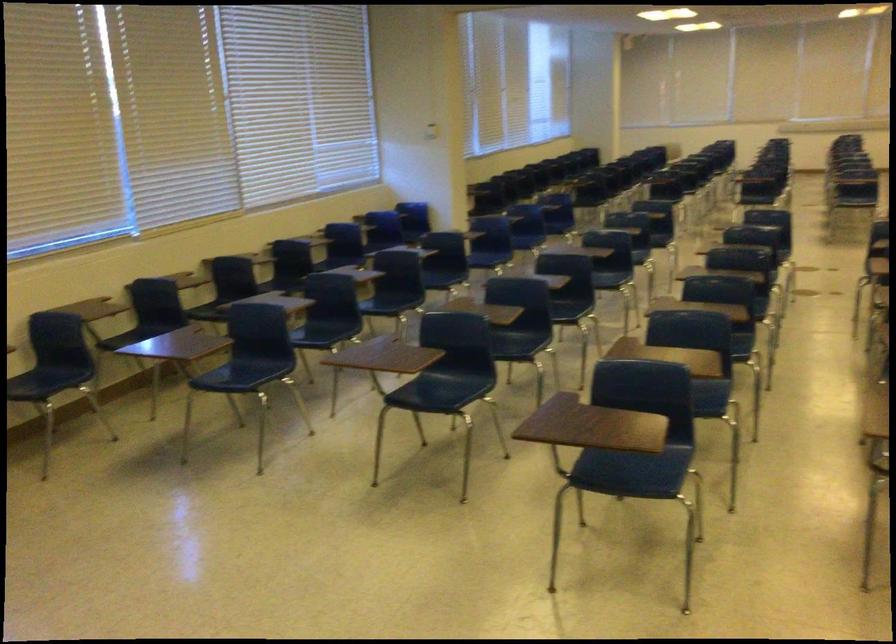
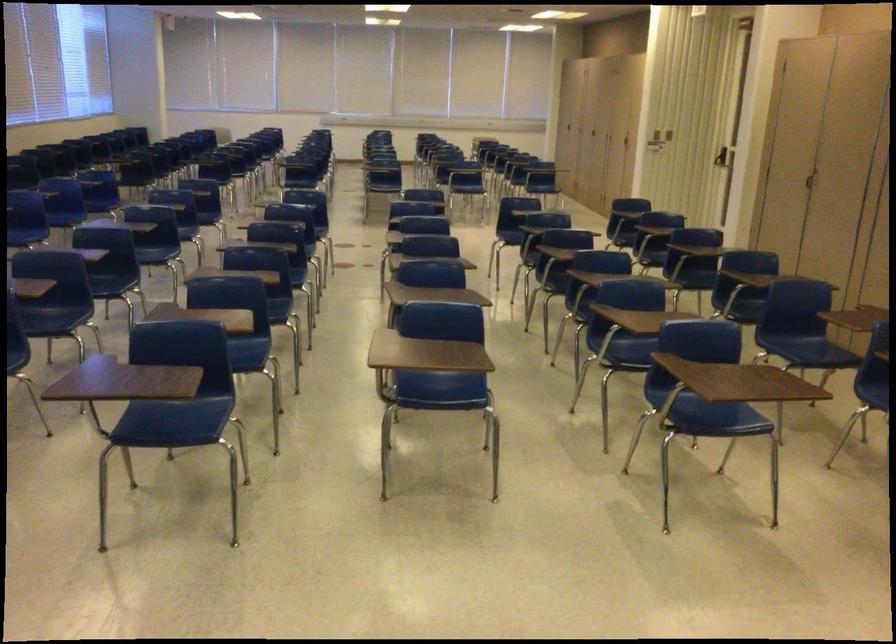
The point at (632,469) is marked in the first image. Where is the corresponding point in the second image?

(173, 422)